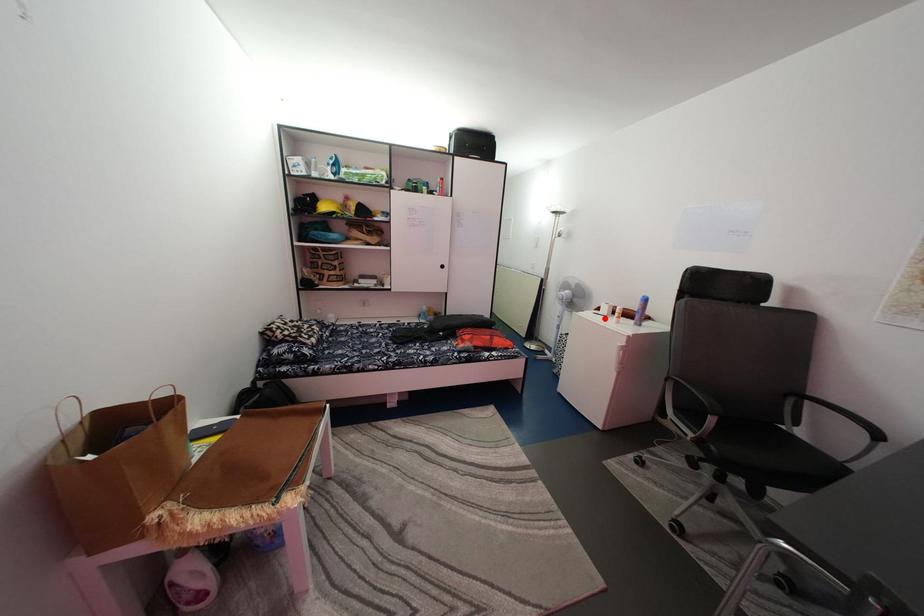
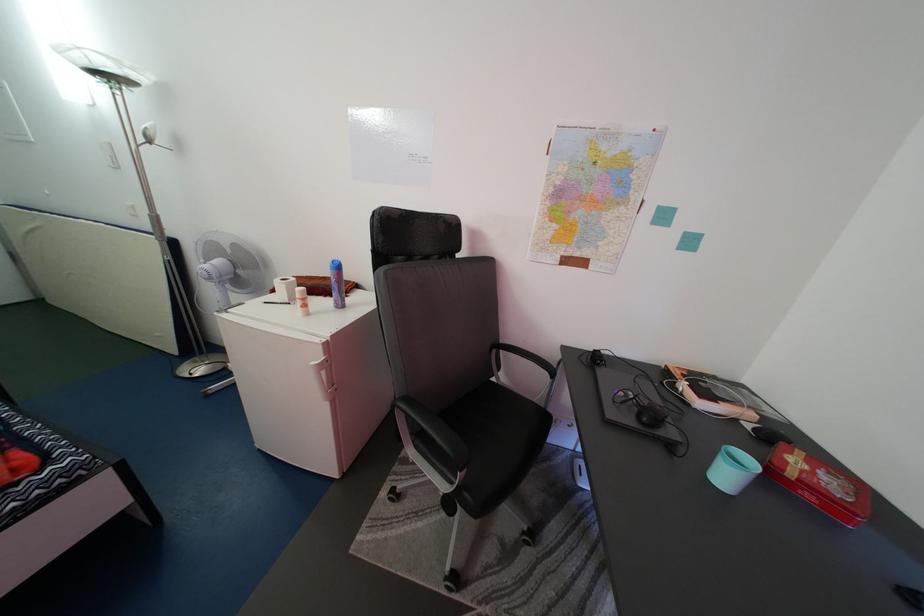
Question: I am providing you with two images of the same scene from different viewpoints. A red point is marked on the first image. Is the red point's position out of view in image 2?

Choices:
 (A) Yes
 (B) No

Answer: (B)